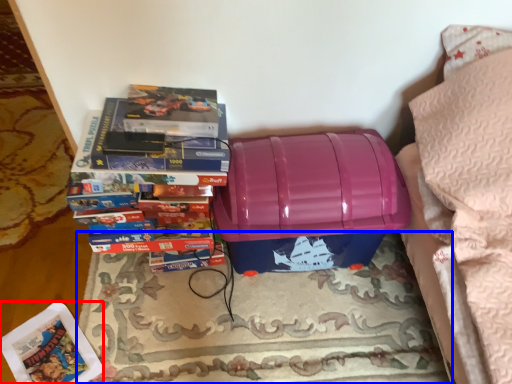
Question: Among these objects, which one is nearest to the camera, paperback book (highlighted by a red box) or mat (highlighted by a blue box)?

Choices:
 (A) paperback book
 (B) mat

Answer: (B)